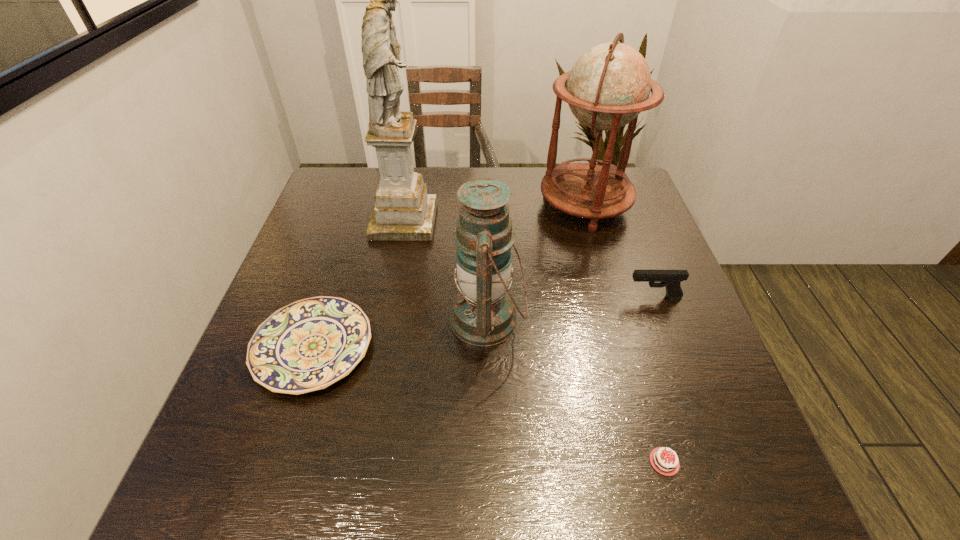
Image resolution: width=960 pixels, height=540 pixels. What are the coordinates of `vacant area at the near right corner of the desktop` in the screenshot? It's located at (771, 502).

Locate an element on the screen. free space between the globe and the chocolate cake is located at coordinates (624, 334).

At what (x,y) coordinates should I click in order to perform the action: click on vacant space in between the pistol and the fourth object from right to left. Please return your answer as a coordinate pair (x, y). The height and width of the screenshot is (540, 960). Looking at the image, I should click on tap(570, 308).

This screenshot has width=960, height=540. Identify the location of vacant space in between the plate and the oil lamp. (400, 334).

You are a GUI agent. You are given a task and a screenshot of the screen. Output one action in this format:
    pyautogui.click(x=<x>, y=<y>)
    Task: Click on the free space between the third tallest object and the sculpture
    This screenshot has width=960, height=540.
    Given the screenshot: What is the action you would take?
    pyautogui.click(x=445, y=270)

Find the location of a particular element. The height and width of the screenshot is (540, 960). empty location between the globe and the pistol is located at coordinates (619, 251).

Identify the location of vacant space in between the nearest object and the plate. This screenshot has width=960, height=540. (489, 405).

At what (x,y) coordinates should I click in order to perform the action: click on unoccupied position between the fifth shortest object and the oil lamp. Please return your answer as a coordinate pair (x, y). Looking at the image, I should click on (536, 262).

Find the location of a particular element. Image resolution: width=960 pixels, height=540 pixels. object that ranks as the closest to the sculpture is located at coordinates (483, 314).

Find the location of a particular element. This screenshot has width=960, height=540. object that is the closest one to the third object from left to right is located at coordinates (308, 345).